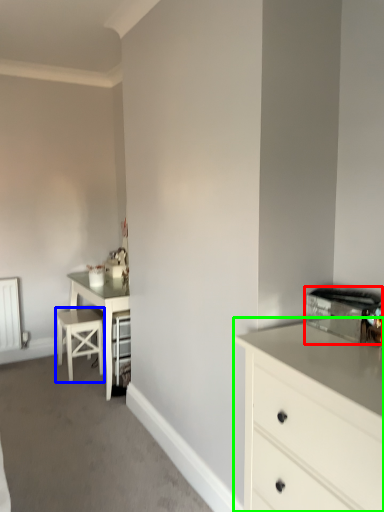
Question: Based on their relative distances, which object is farther from appliance (highlighted by a red box)? Choose from bar stool (highlighted by a blue box) and chest of drawers (highlighted by a green box).

Choices:
 (A) bar stool
 (B) chest of drawers

Answer: (A)